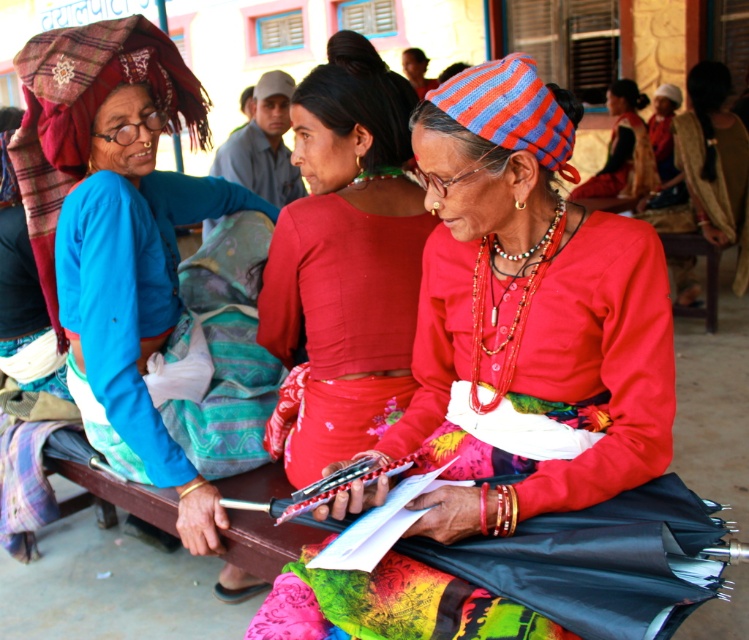
From the picture: You are a photographer setting up a tripod to capture the scene. The matte blue shirt at left and the red fabric skirt at center are in your viewfinder. Which object should you adjust your focus on if you want to ensure the taller one is in sharp focus?

The matte blue shirt at left is taller than the red fabric skirt at center, so you should focus on the matte blue shirt at left to ensure it is in sharp focus.

Looking at this image, you are organizing a clothing donation drive and need to determine which item takes up more space. Based on the scene, which is larger in size between the matte blue shirt at left and the red fabric skirt at center?

The matte blue shirt at left is bigger than the red fabric skirt at center, so it takes up more space and would require more storage space during the donation drive.